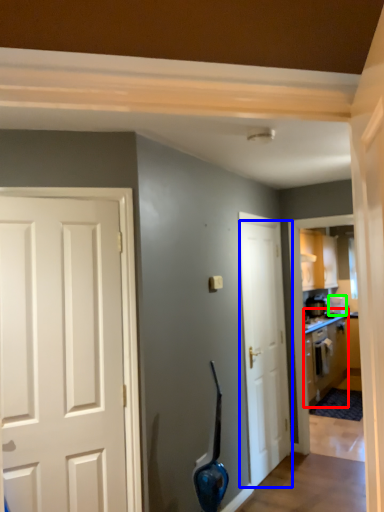
Question: Which is nearer to the cabinetry (highlighted by a red box)? door (highlighted by a blue box) or appliance (highlighted by a green box).

Choices:
 (A) door
 (B) appliance

Answer: (B)